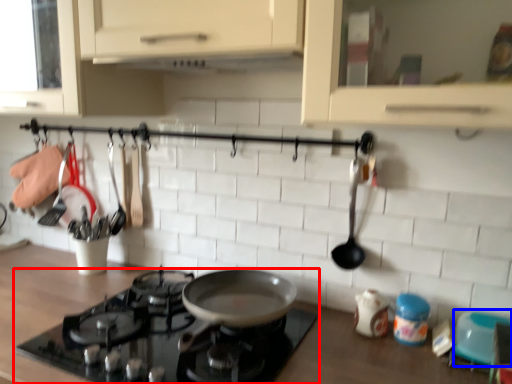
Question: Which object appears closest to the camera in this image, gas stove (highlighted by a red box) or appliance (highlighted by a blue box)?

Choices:
 (A) gas stove
 (B) appliance

Answer: (A)